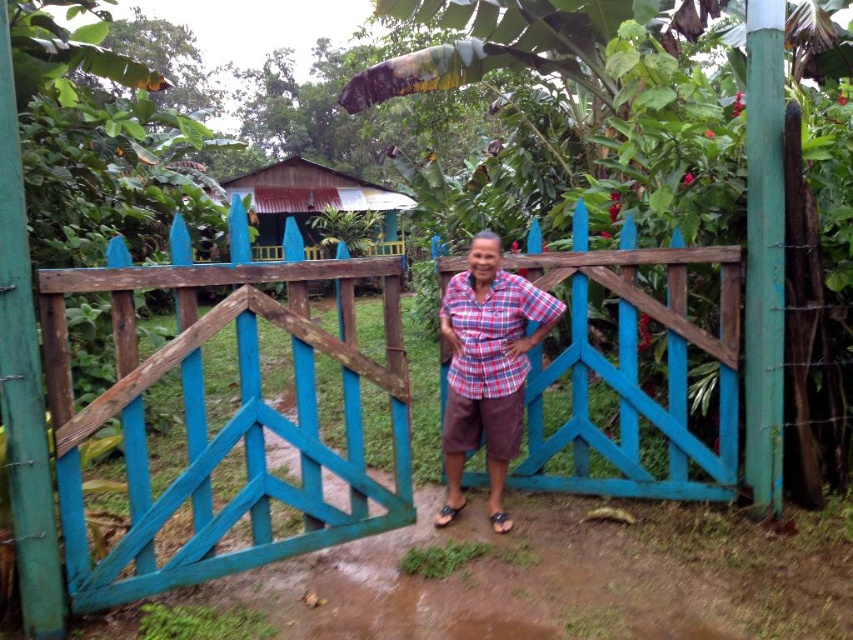
You are a hiker who has just arrived at a rustic wooden gate. You notice a rusty metal hut at center and a brown leather sandal at lower center. Which object is closer to you, the hiker?

The brown leather sandal at lower center is behind the rusty metal hut at center, so the rusty metal hut at center is closer to you.